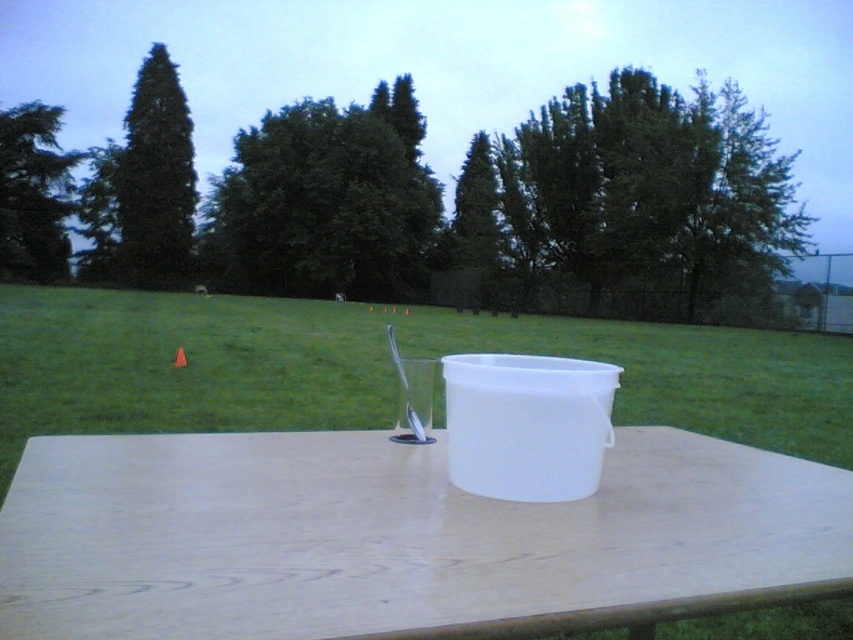
You are trying to decide whether to place a small potted plant on the white wood table at center or next to the white plastic bucket at center. Based on their heights, which surface would allow the plant to be more visible from a distance?

The white plastic bucket at center is taller than the white wood table at center, so placing the plant on the white plastic bucket at center would make it more visible from a distance.

You are setting up for a picnic and need to place a large blanket. Given the white wood table at center and the green grass at center, which area has enough space to accommodate the blanket?

The green grass at center has a greater width than the white wood table at center, so it can accommodate the blanket.

You are standing in the outdoor scene and want to walk from point A to point B. Point A is at coordinates point(248, 356) and point B is at coordinates point(454, 474). Since you can only move forward, will you have to walk towards or away from the viewer to reach point B from point A?

Since point(248, 356) is closer to the viewer than point(454, 474), you will need to walk away from the viewer to reach point B from point A.